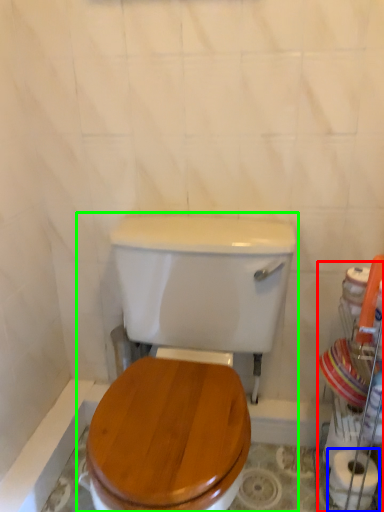
Question: Considering the real-world distances, which object is farthest from porcelain (highlighted by a red box)? toilet paper (highlighted by a blue box) or toilet (highlighted by a green box)?

Choices:
 (A) toilet paper
 (B) toilet

Answer: (B)